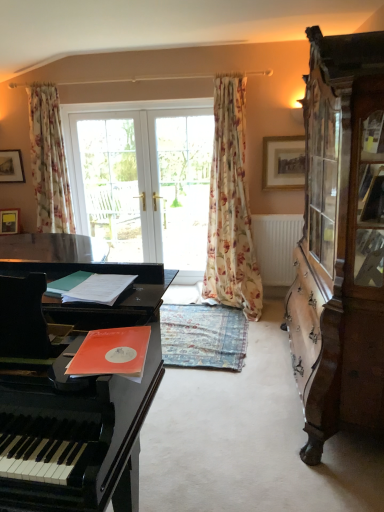
Question: Is white glass doors at center thinner than clear glass door at center, which appears as the second screen door when viewed from the right?

Choices:
 (A) yes
 (B) no

Answer: (A)

Question: Is there a large distance between white glass doors at center and clear glass door at center, positioned as the first screen door in left-to-right order?

Choices:
 (A) no
 (B) yes

Answer: (A)

Question: Considering the relative sizes of white glass doors at center and clear glass door at center, which appears as the second screen door when viewed from the right, in the image provided, is white glass doors at center wider than clear glass door at center, which appears as the second screen door when viewed from the right,?

Choices:
 (A) yes
 (B) no

Answer: (B)

Question: Does white glass doors at center contain clear glass door at center, positioned as the first screen door in left-to-right order?

Choices:
 (A) yes
 (B) no

Answer: (A)

Question: Is white glass doors at center oriented away from clear glass door at center, which appears as the second screen door when viewed from the right?

Choices:
 (A) yes
 (B) no

Answer: (A)

Question: From the image's perspective, is white glass doors at center beneath clear glass door at center, positioned as the first screen door in left-to-right order?

Choices:
 (A) no
 (B) yes

Answer: (B)

Question: Is floral fabric curtain at upper left, acting as the 2th curtain starting from the right, shorter than white glass doors at center?

Choices:
 (A) yes
 (B) no

Answer: (A)

Question: Is floral fabric curtain at upper left, which is the 1th curtain from left to right, positioned before white glass doors at center?

Choices:
 (A) yes
 (B) no

Answer: (A)

Question: From the image's perspective, does floral fabric curtain at upper left, which is the 1th curtain from left to right, appear lower than white glass doors at center?

Choices:
 (A) yes
 (B) no

Answer: (B)

Question: Could white glass doors at center be considered to be inside floral fabric curtain at upper left, which is the 1th curtain from left to right?

Choices:
 (A) no
 (B) yes

Answer: (A)

Question: Considering the relative sizes of floral fabric curtain at upper left, which is the 1th curtain from left to right, and white glass doors at center in the image provided, is floral fabric curtain at upper left, which is the 1th curtain from left to right, smaller than white glass doors at center?

Choices:
 (A) no
 (B) yes

Answer: (A)

Question: Can you confirm if floral fabric curtain at upper left, which is the 1th curtain from left to right, is bigger than white glass doors at center?

Choices:
 (A) yes
 (B) no

Answer: (A)

Question: Is wooden cabinet at right aimed at floral fabric curtain at upper left, acting as the 2th curtain starting from the right?

Choices:
 (A) yes
 (B) no

Answer: (A)